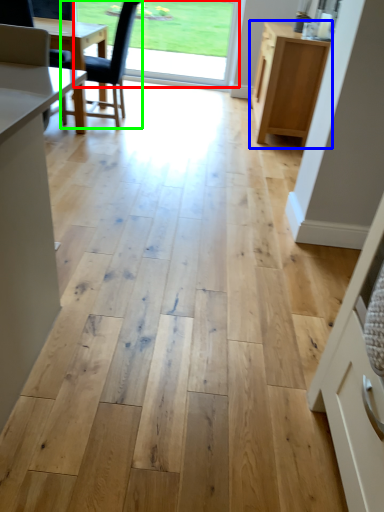
Question: Which object is positioned closest to window screen (highlighted by a red box)? Select from cabinetry (highlighted by a blue box) and chair (highlighted by a green box).

Choices:
 (A) cabinetry
 (B) chair

Answer: (B)